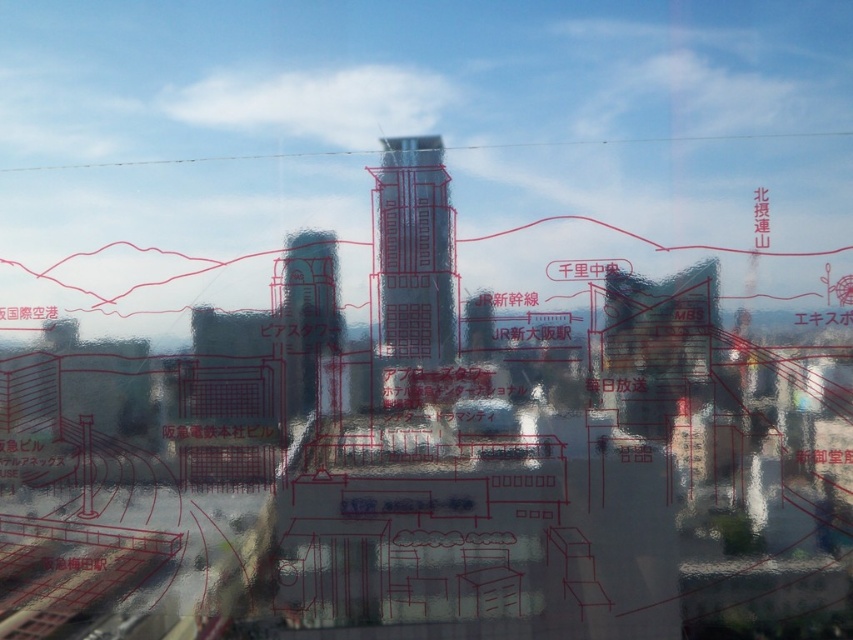
You are an architect reviewing a city map overlay. The map shows two central structures, the matte glass skyscraper at center and the transparent glass tower at center. Which one has a larger size according to the overlay?

The matte glass skyscraper at center is bigger than the transparent glass tower at center according to the overlay.

You are an architect reviewing a city map overlay displayed on a window. The map shows two central buildings labeled as the matte glass skyscraper at center and the transparent glass tower at center. According to the overlay, which building is located to the right of the other?

The matte glass skyscraper at center is positioned on the right side of the transparent glass tower at center, so it is to the right of the transparent glass tower at center.